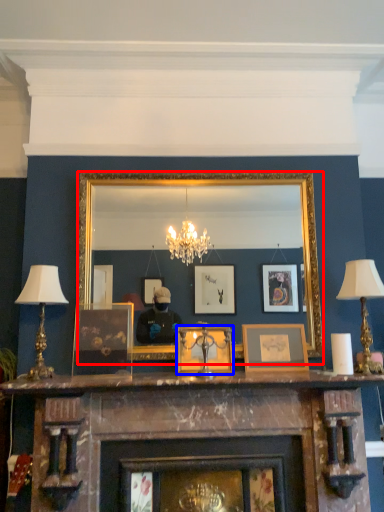
Question: Which object appears closest to the camera in this image, mirror (highlighted by a red box) or picture frame (highlighted by a blue box)?

Choices:
 (A) mirror
 (B) picture frame

Answer: (B)